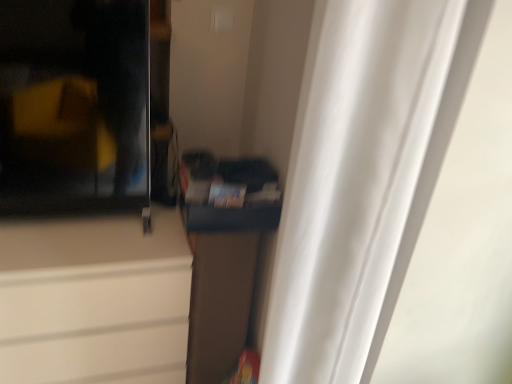
Question: Is transparent glass screen door at upper left at the back of brown fabric cabinet at center, which is the second cabinetry from left to right?

Choices:
 (A) yes
 (B) no

Answer: (B)

Question: Considering the relative sizes of brown fabric cabinet at center, positioned as the first cabinetry in right-to-left order, and transparent glass screen door at upper left in the image provided, is brown fabric cabinet at center, positioned as the first cabinetry in right-to-left order, wider than transparent glass screen door at upper left?

Choices:
 (A) yes
 (B) no

Answer: (A)

Question: From a real-world perspective, is brown fabric cabinet at center, positioned as the first cabinetry in right-to-left order, on top of transparent glass screen door at upper left?

Choices:
 (A) yes
 (B) no

Answer: (B)

Question: Considering the relative sizes of brown fabric cabinet at center, positioned as the first cabinetry in right-to-left order, and transparent glass screen door at upper left in the image provided, is brown fabric cabinet at center, positioned as the first cabinetry in right-to-left order, smaller than transparent glass screen door at upper left?

Choices:
 (A) no
 (B) yes

Answer: (A)

Question: Is brown fabric cabinet at center, positioned as the first cabinetry in right-to-left order, positioned beyond the bounds of transparent glass screen door at upper left?

Choices:
 (A) yes
 (B) no

Answer: (A)

Question: Is brown fabric cabinet at center, positioned as the first cabinetry in right-to-left order, shorter than transparent glass screen door at upper left?

Choices:
 (A) no
 (B) yes

Answer: (A)

Question: Does transparent glass screen door at upper left have a larger size compared to matte white cabinet at left, which ranks as the second cabinetry in right-to-left order?

Choices:
 (A) yes
 (B) no

Answer: (B)

Question: Is transparent glass screen door at upper left at the left side of matte white cabinet at left, acting as the first cabinetry starting from the left?

Choices:
 (A) yes
 (B) no

Answer: (B)

Question: Is transparent glass screen door at upper left positioned far away from matte white cabinet at left, acting as the first cabinetry starting from the left?

Choices:
 (A) yes
 (B) no

Answer: (B)

Question: Is transparent glass screen door at upper left closer to the viewer compared to matte white cabinet at left, acting as the first cabinetry starting from the left?

Choices:
 (A) no
 (B) yes

Answer: (B)

Question: Could matte white cabinet at left, acting as the first cabinetry starting from the left, be considered to be inside transparent glass screen door at upper left?

Choices:
 (A) yes
 (B) no

Answer: (B)

Question: Is transparent glass screen door at upper left to the right of matte white cabinet at left, which ranks as the second cabinetry in right-to-left order, from the viewer's perspective?

Choices:
 (A) no
 (B) yes

Answer: (B)

Question: From a real-world perspective, is white sheer curtain at right beneath transparent glass screen door at upper left?

Choices:
 (A) no
 (B) yes

Answer: (B)